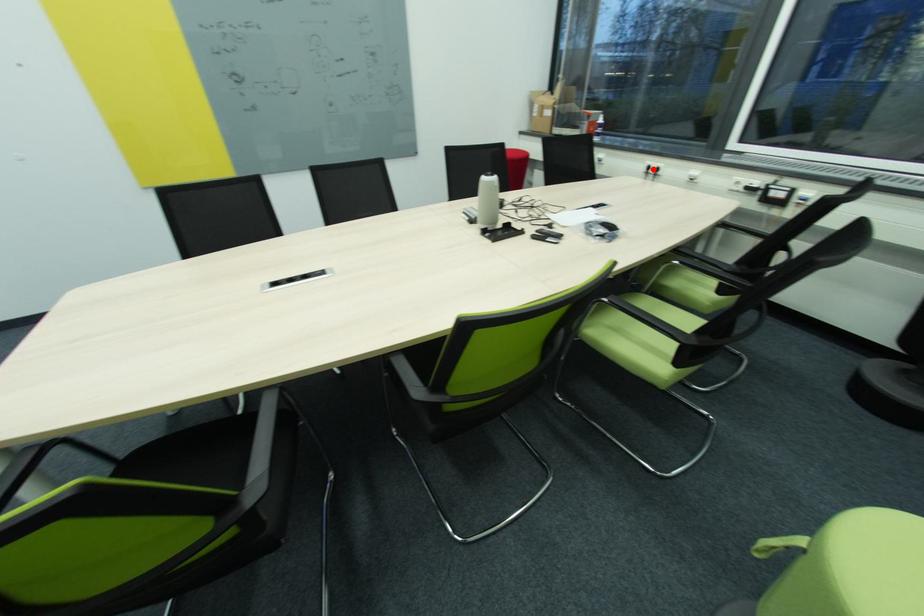
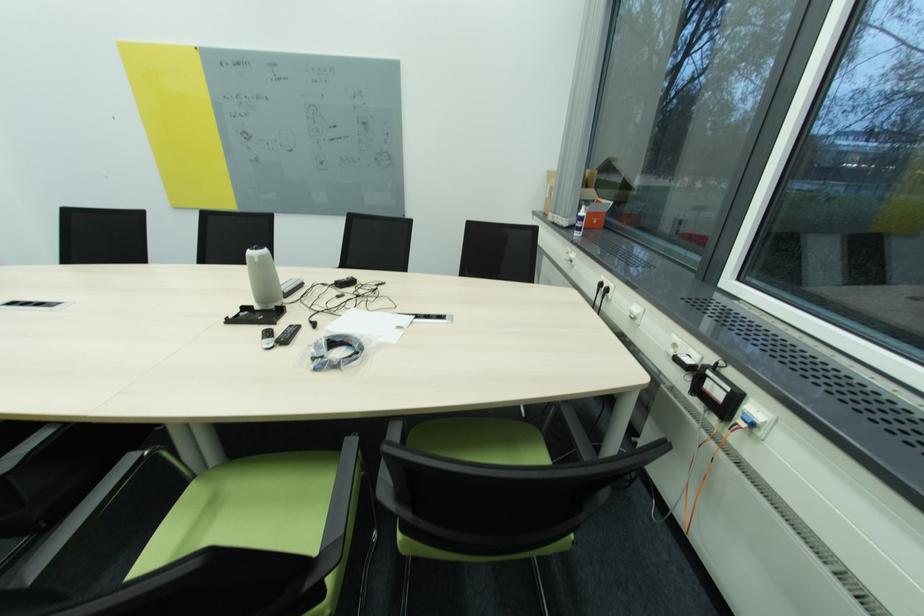
Question: I am providing you with two images of the same scene from different viewpoints. In image1, a red point is highlighted. Considering the same 3D point in image2, which of the following is correct?

Choices:
 (A) It is closer
 (B) It is farther

Answer: (A)